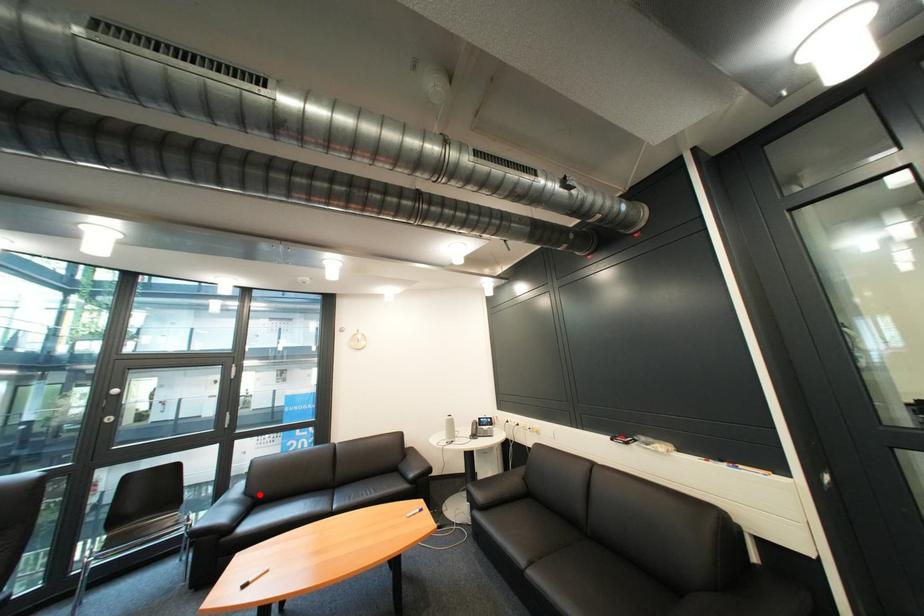
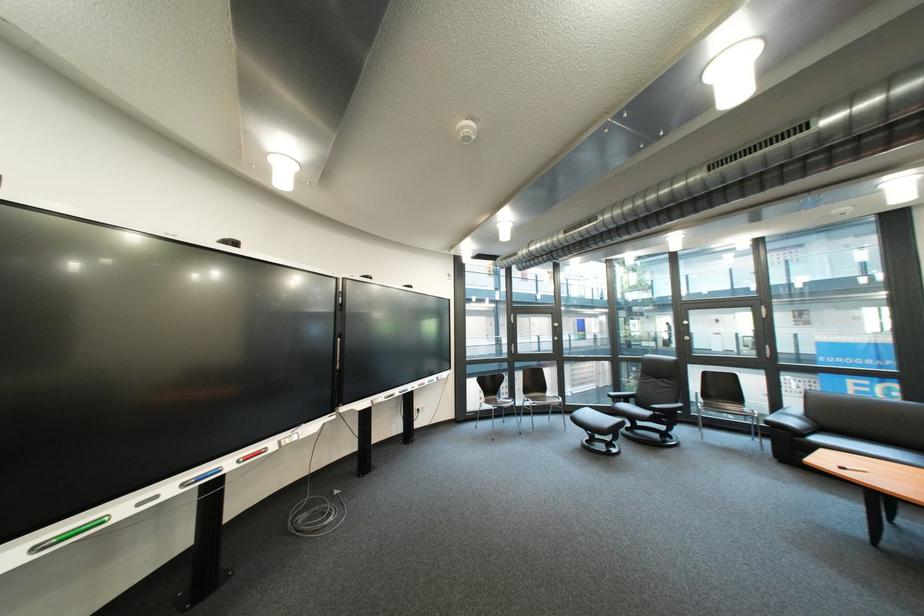
The point at the highlighted location is marked in the first image. Where is the corresponding point in the second image?

(822, 418)